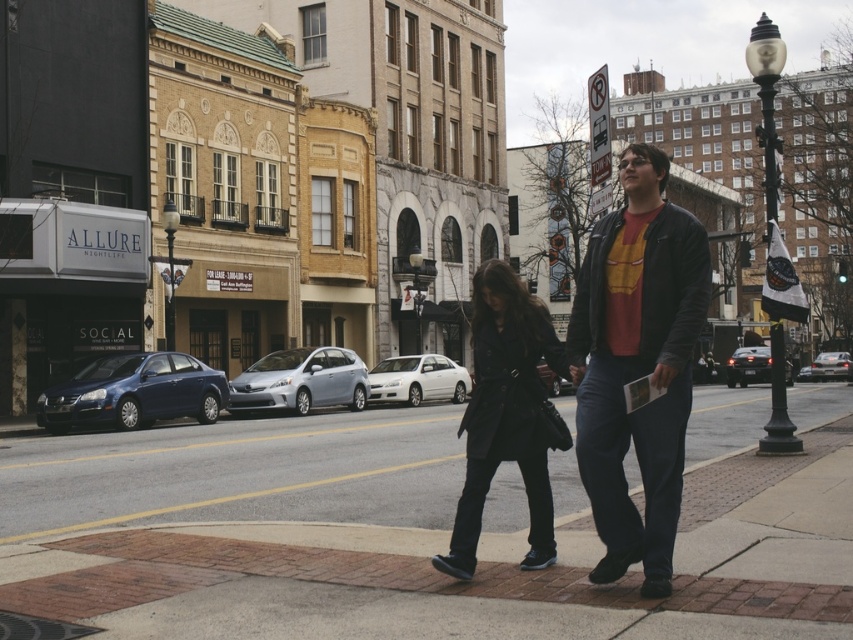
Question: Does matte black jacket at center appear on the right side of shiny black sedan at center?

Choices:
 (A) no
 (B) yes

Answer: (A)

Question: Is the position of smooth concrete sidewalk at center less distant than that of satin silver hatchback at center?

Choices:
 (A) yes
 (B) no

Answer: (A)

Question: Which object appears farthest from the camera in this image?

Choices:
 (A) white matte sedan at center
 (B) shiny blue sedan at left
 (C) satin silver hatchback at center

Answer: (A)

Question: Which point is closer to the camera?

Choices:
 (A) (837, 376)
 (B) (259, 428)
 (C) (735, 372)

Answer: (B)

Question: Does satin silver hatchback at center appear on the right side of white matte sedan at center?

Choices:
 (A) yes
 (B) no

Answer: (B)

Question: Which point is farther from the camera taking this photo?

Choices:
 (A) (737, 348)
 (B) (252, 401)

Answer: (A)